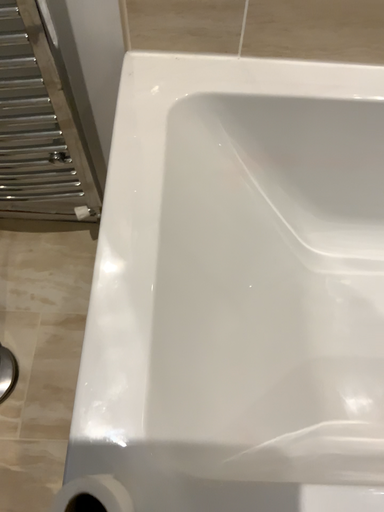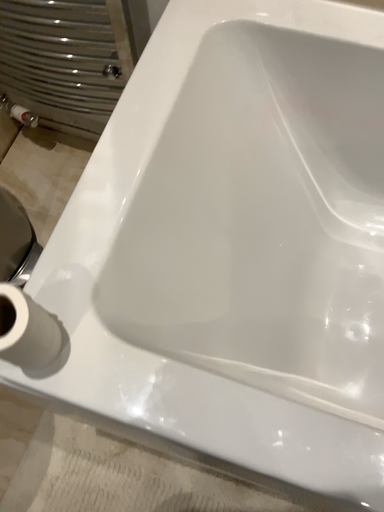
Question: Which way did the camera rotate in the video?

Choices:
 (A) rotated right
 (B) rotated left

Answer: (B)